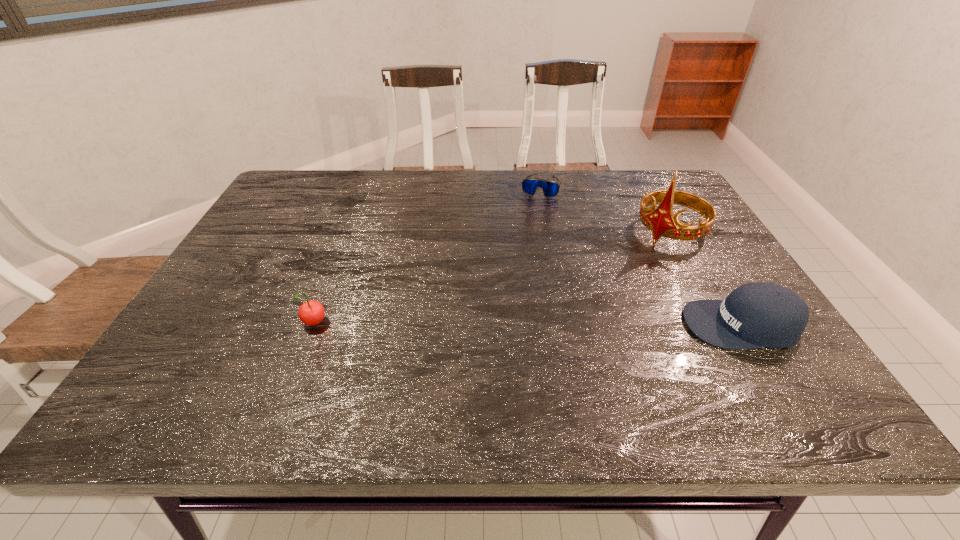
Where is `blank space located 0.240m on the front-facing side of the farthest object`? This screenshot has width=960, height=540. blank space located 0.240m on the front-facing side of the farthest object is located at coordinates (525, 244).

I want to click on vacant space located on the front-facing side of the farthest object, so [533, 214].

Locate an element on the screen. The image size is (960, 540). free region located on the front-facing side of the farthest object is located at coordinates (532, 220).

Identify the location of free location located 0.190m on the front-facing side of the tallest object. (612, 282).

The height and width of the screenshot is (540, 960). Identify the location of free space located 0.280m on the front-facing side of the tallest object. (589, 301).

Image resolution: width=960 pixels, height=540 pixels. In order to click on free space located on the front-facing side of the tallest object in this screenshot , I will do `click(569, 319)`.

The height and width of the screenshot is (540, 960). What are the coordinates of `object at the far edge` in the screenshot? It's located at (550, 188).

Find the location of a particular element. The height and width of the screenshot is (540, 960). object positioned at the near edge is located at coordinates (756, 315).

Find the location of a particular element. The image size is (960, 540). baseball cap that is at the right edge is located at coordinates (756, 315).

Find the location of a particular element. tiara present at the right edge is located at coordinates (661, 221).